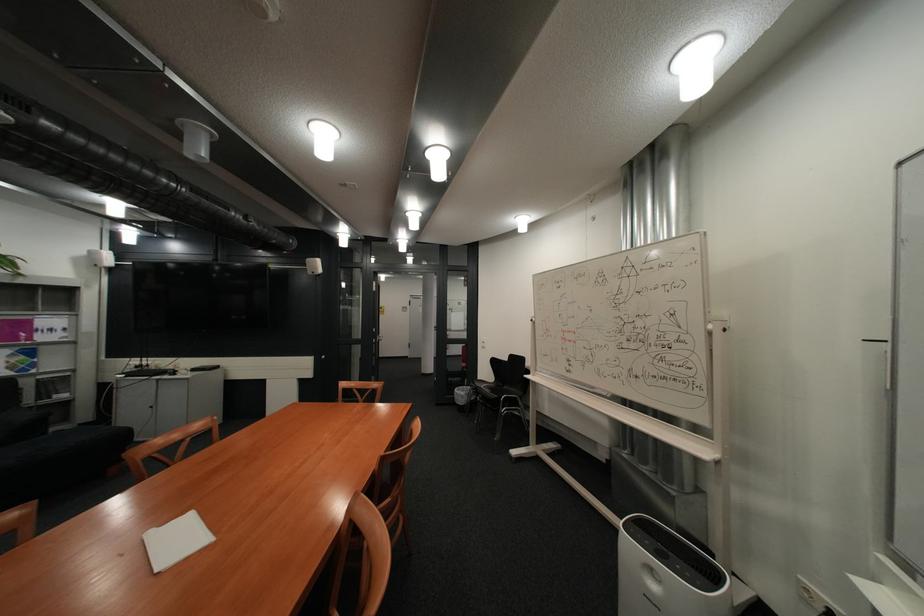
The width and height of the screenshot is (924, 616). What do you see at coordinates (496, 395) in the screenshot?
I see `a black chair sitting surface` at bounding box center [496, 395].